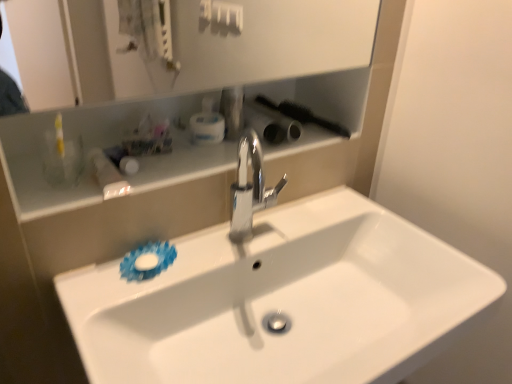
Question: From the image's perspective, is white glossy sink at center over white plastic container at upper center, positioned as the second toiletry in left-to-right order?

Choices:
 (A) yes
 (B) no

Answer: (B)

Question: Considering the relative sizes of white glossy sink at center and white plastic container at upper center, arranged as the 2th toiletry when viewed from the right, in the image provided, is white glossy sink at center smaller than white plastic container at upper center, arranged as the 2th toiletry when viewed from the right,?

Choices:
 (A) yes
 (B) no

Answer: (B)

Question: Is white glossy sink at center further to camera compared to white plastic container at upper center, positioned as the second toiletry in left-to-right order?

Choices:
 (A) no
 (B) yes

Answer: (A)

Question: Is white plastic container at upper center, positioned as the second toiletry in left-to-right order, surrounded by white glossy sink at center?

Choices:
 (A) yes
 (B) no

Answer: (B)

Question: Is white glossy sink at center next to white plastic container at upper center, arranged as the 2th toiletry when viewed from the right, and touching it?

Choices:
 (A) yes
 (B) no

Answer: (B)

Question: Is white glossy sink at center wider or thinner than white glossy shelf at upper center?

Choices:
 (A) thin
 (B) wide

Answer: (B)

Question: Is white glossy sink at center taller or shorter than white glossy shelf at upper center?

Choices:
 (A) tall
 (B) short

Answer: (A)

Question: From the image's perspective, is white glossy sink at center located above or below white glossy shelf at upper center?

Choices:
 (A) above
 (B) below

Answer: (B)

Question: Based on their sizes in the image, would you say white glossy sink at center is bigger or smaller than white glossy shelf at upper center?

Choices:
 (A) small
 (B) big

Answer: (B)

Question: From a real-world perspective, is white glossy bottle at upper left, placed as the 1th toiletry when sorted from left to right, above or below white plastic container at upper center, arranged as the 2th toiletry when viewed from the right?

Choices:
 (A) above
 (B) below

Answer: (B)

Question: From the image's perspective, is white glossy bottle at upper left, placed as the 1th toiletry when sorted from left to right, located above or below white plastic container at upper center, arranged as the 2th toiletry when viewed from the right?

Choices:
 (A) above
 (B) below

Answer: (B)

Question: Would you say white glossy bottle at upper left, placed as the 1th toiletry when sorted from left to right, is to the left or to the right of white plastic container at upper center, positioned as the second toiletry in left-to-right order, in the picture?

Choices:
 (A) left
 (B) right

Answer: (A)

Question: Do you think white glossy bottle at upper left, which appears as the 3th toiletry when viewed from the right, is within white plastic container at upper center, positioned as the second toiletry in left-to-right order, or outside of it?

Choices:
 (A) inside
 (B) outside

Answer: (B)

Question: Is white glossy sink at center situated inside polished chrome faucet at center or outside?

Choices:
 (A) inside
 (B) outside

Answer: (B)

Question: Is white glossy sink at center bigger or smaller than polished chrome faucet at center?

Choices:
 (A) big
 (B) small

Answer: (A)